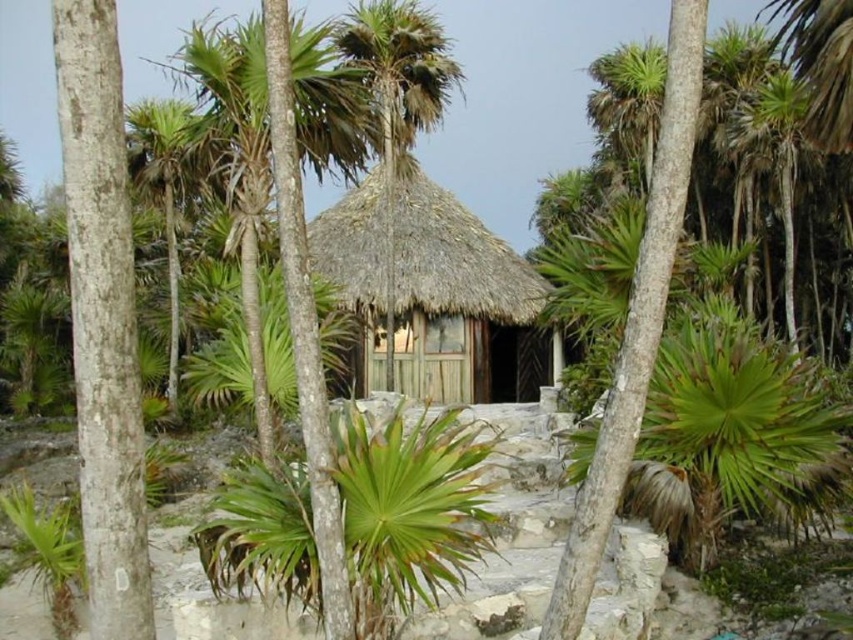
You are standing in front of the rustic hut and notice two trees nearby. The first is a white smooth tree trunk at left, and the second is a green leafy palm tree at upper left. Which tree is taller?

The green leafy palm tree at upper left is taller than the white smooth tree trunk at left.

You are standing in front of the rustic hut and want to locate the white smooth tree trunk at left. According to the coordinates provided, where should you look relative to the hut?

The white smooth tree trunk at left is located at point 0.498 on the x axis and 0.121 on the y axis, so you should look to the left side of the hut.

You are planning to place a large wooden bench between the white smooth tree trunk at left and the thatched wood hut at center. Based on their widths, can the bench fit between them without touching either?

The white smooth tree trunk at left might be wider than thatched wood hut at center, so there is uncertainty about the available space between them. It is possible the bench may not fit properly without touching one or both objects due to the tree trunk potentially being wider.